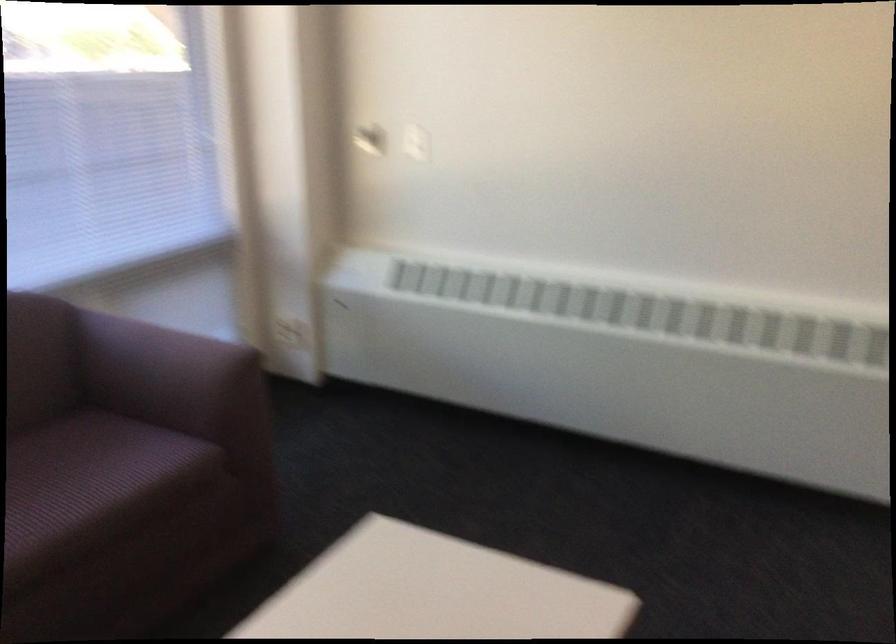
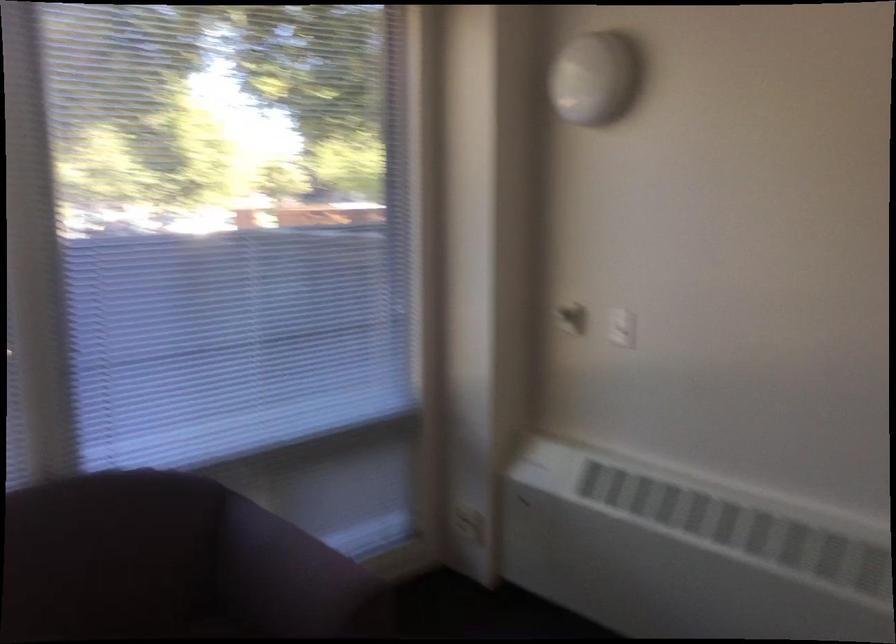
Question: In a continuous first-person perspective shot, in which direction is the camera moving?

Choices:
 (A) Left
 (B) Right
 (C) Forward
 (D) Backward

Answer: (C)